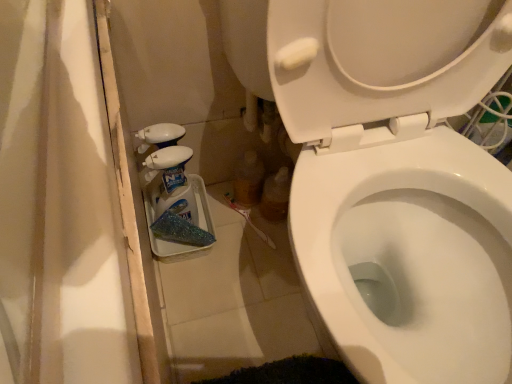
Where is `translucent plastic cleaning product at lower left`? Image resolution: width=512 pixels, height=384 pixels. translucent plastic cleaning product at lower left is located at coordinates (170, 183).

This screenshot has width=512, height=384. Describe the element at coordinates (170, 183) in the screenshot. I see `translucent plastic cleaning product at lower left` at that location.

In order to face translucent plastic cleaning product at lower left, should I rotate leftwards or rightwards?

You should look left and rotate roughly 10.924 degrees.

Locate an element on the screen. Image resolution: width=512 pixels, height=384 pixels. translucent plastic cleaning product at lower left is located at coordinates (170, 183).